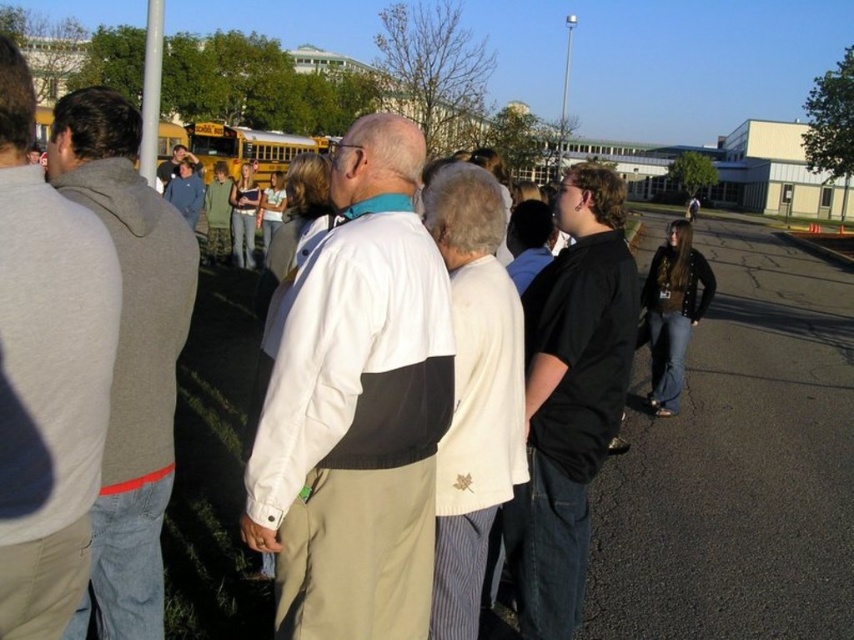
Question: Which of these objects is positioned farthest from the gray fleece sweatshirt at left?

Choices:
 (A) yellow metallic school bus at center
 (B) white matte jacket at center
 (C) black matte shirt at center
 (D) matte black shirt at center

Answer: (A)

Question: Which point is farther to the camera?

Choices:
 (A) yellow metallic school bus at center
 (B) black matte shirt at center
 (C) gray fleece sweatshirt at left
 (D) matte black shirt at center

Answer: (A)

Question: Can you confirm if white matte jacket at center is wider than matte black shirt at center?

Choices:
 (A) yes
 (B) no

Answer: (B)

Question: Is yellow metallic school bus at center below matte black shirt at center?

Choices:
 (A) no
 (B) yes

Answer: (A)

Question: Which of these objects is positioned farthest from the gray fleece sweatshirt at left?

Choices:
 (A) yellow metallic school bus at center
 (B) matte black shirt at center
 (C) white matte jacket at center
 (D) black matte shirt at center

Answer: (A)

Question: Is white matte jacket at center to the left of matte black shirt at center from the viewer's perspective?

Choices:
 (A) no
 (B) yes

Answer: (A)